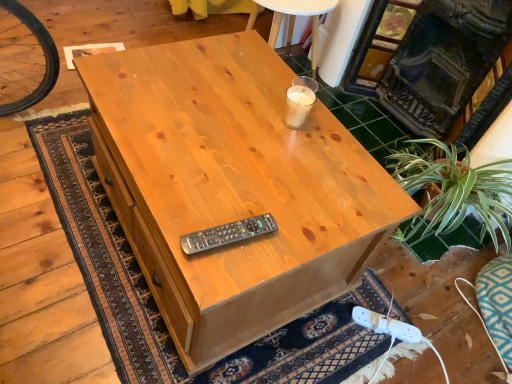
The width and height of the screenshot is (512, 384). Find the location of `vacant space positioned to the left of white plastic plug at lower right`. vacant space positioned to the left of white plastic plug at lower right is located at coordinates (342, 328).